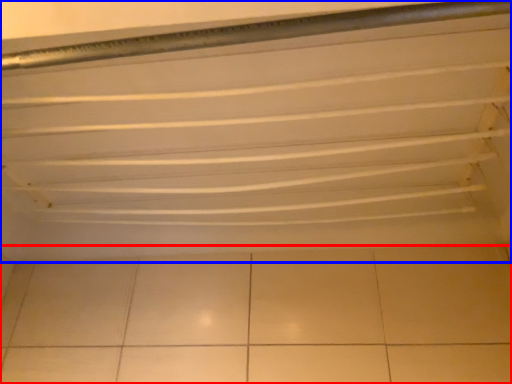
Question: Which of the following is the closest to the observer, ceramic tile (highlighted by a red box) or shelf (highlighted by a blue box)?

Choices:
 (A) ceramic tile
 (B) shelf

Answer: (B)